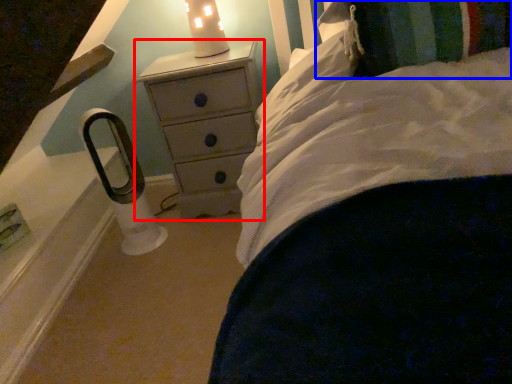
Question: Which object appears farthest to the camera in this image, chest of drawers (highlighted by a red box) or pillow (highlighted by a blue box)?

Choices:
 (A) chest of drawers
 (B) pillow

Answer: (A)